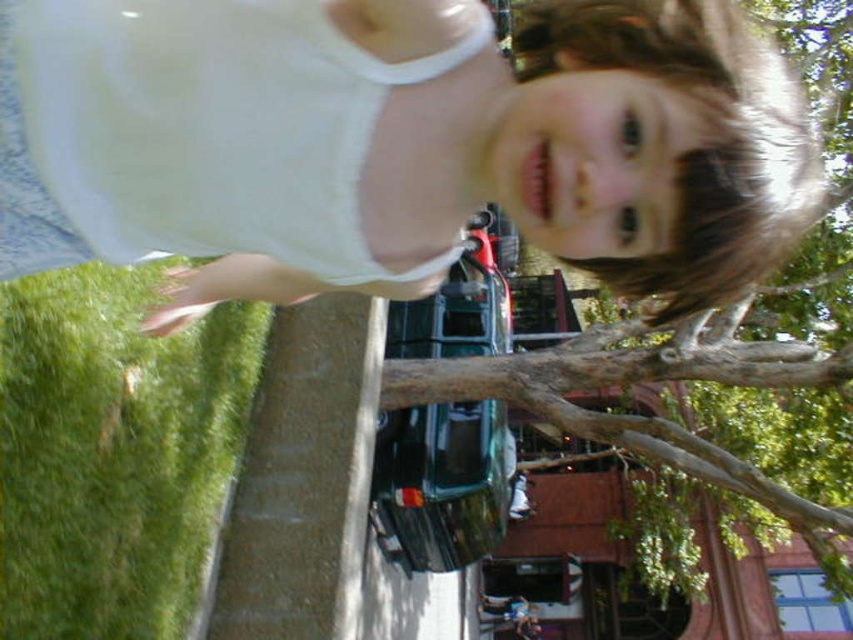
You are a photographer trying to capture the child in the white cotton shirt at upper center and the brown rough tree branch at center. Based on their positions, which object is closer to the left side of the image?

The white cotton shirt at upper center is positioned to the left of the brown rough tree branch at center, so it is closer to the left side of the image.

You are a photographer trying to capture a clear shot of the brown rough tree branch at center without the white cotton shirt at upper center blocking it. Based on their positions, is this possible?

The white cotton shirt at upper center is positioned over the brown rough tree branch at center, so it is blocking the view. To capture a clear shot of the brown rough tree branch at center, you would need to adjust your angle or move the white cotton shirt at upper center out of the way.